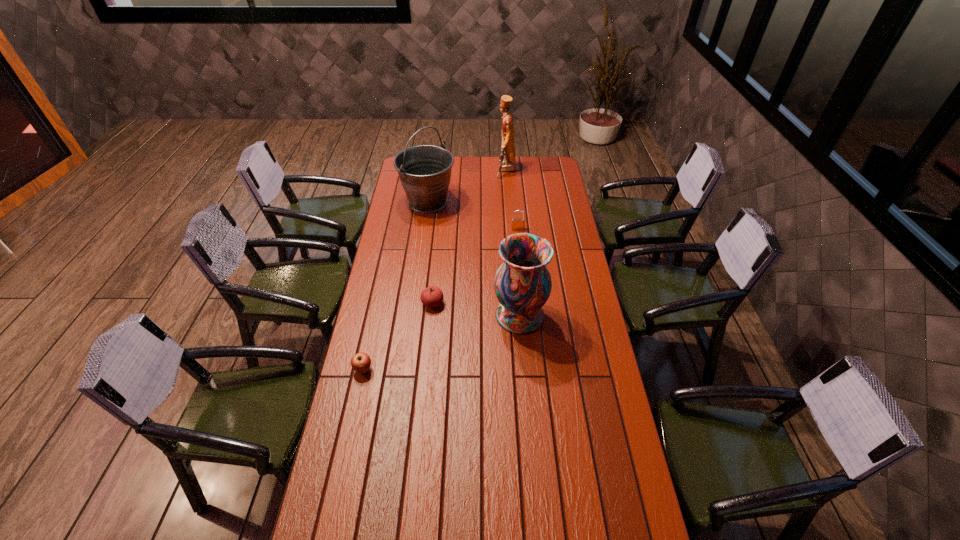
Where is `the farthest object`? The image size is (960, 540). the farthest object is located at coordinates (507, 162).

Find the location of a particular element. Image resolution: width=960 pixels, height=540 pixels. the second farthest object is located at coordinates (425, 170).

Find the location of `vase`. vase is located at coordinates click(522, 284).

Identify the location of the third farthest object. The width and height of the screenshot is (960, 540). (516, 224).

The height and width of the screenshot is (540, 960). I want to click on padlock, so click(516, 224).

Where is `tomato`? tomato is located at coordinates (432, 296).

You are a GUI agent. You are given a task and a screenshot of the screen. Output one action in this format:
    pyautogui.click(x=<x>, y=<y>)
    Task: Click on the apple
    The height and width of the screenshot is (540, 960).
    Given the screenshot: What is the action you would take?
    pyautogui.click(x=360, y=362)

Locate an element on the screen. free space located 0.160m on the front-facing side of the nutcracker is located at coordinates (468, 170).

At what (x,y) coordinates should I click in order to perform the action: click on free spot located 0.360m on the front-facing side of the nutcracker. Please return your answer as a coordinate pair (x, y). The height and width of the screenshot is (540, 960). Looking at the image, I should click on (434, 170).

Locate an element on the screen. free space located 0.130m on the front-facing side of the nutcracker is located at coordinates (473, 170).